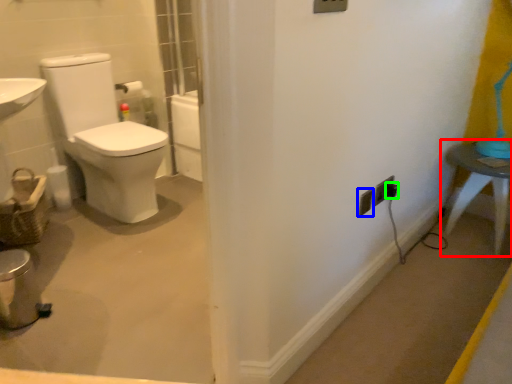
Question: Based on their relative distances, which object is nearer to table (highlighted by a red box)? Choose from electric outlet (highlighted by a blue box) and electric outlet (highlighted by a green box).

Choices:
 (A) electric outlet
 (B) electric outlet

Answer: (B)